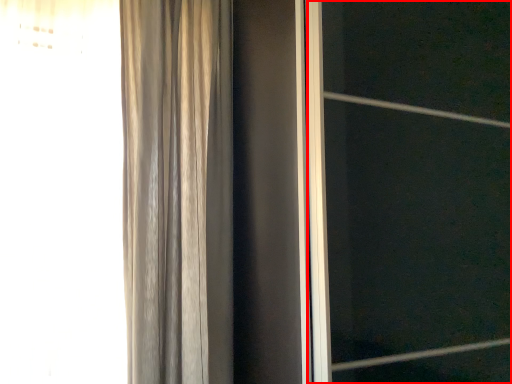
Question: From the image, what is the correct spatial relationship of screen door (annotated by the red box) in relation to curtain?

Choices:
 (A) left
 (B) right

Answer: (B)